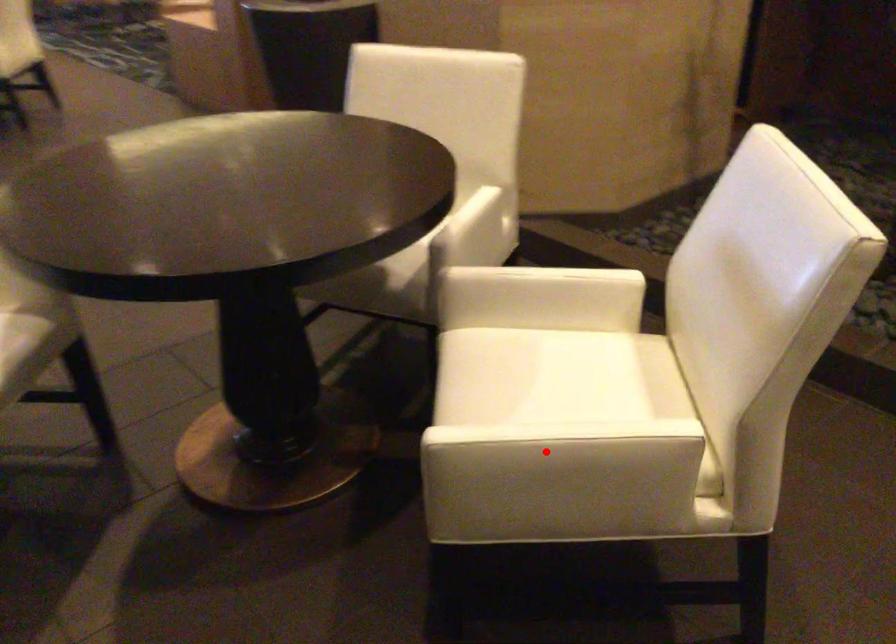
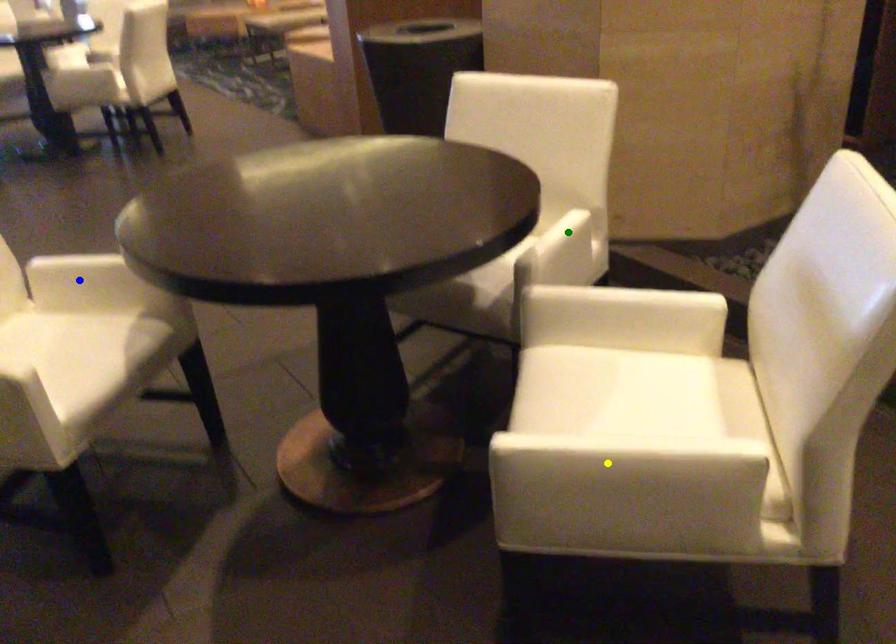
Question: I am providing you with two images of the same scene from different viewpoints. A red point is marked on the first image. You are given multiple points on the second image. Which spot in image 2 lines up with the point in image 1?

Choices:
 (A) blue point
 (B) yellow point
 (C) green point

Answer: (B)